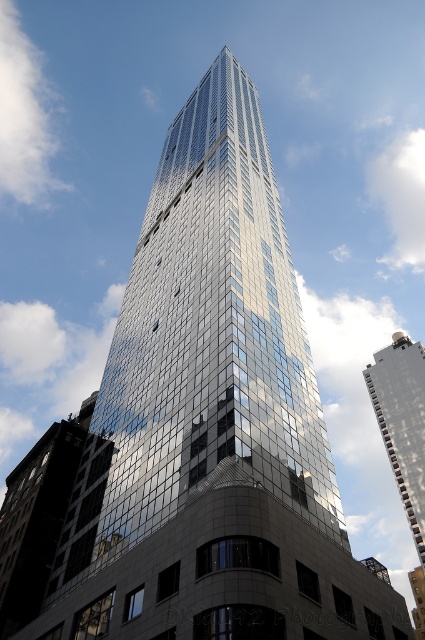
Is glossy glass building at center positioned before glossy glass building at upper center?

Yes, it is.

Is glossy glass building at center wider than glossy glass building at upper center?

Incorrect, glossy glass building at center's width does not surpass glossy glass building at upper center's.

Which is in front, point (42, 525) or point (413, 435)?

Point (42, 525)

The image size is (425, 640). I want to click on glossy glass building at center, so (37, 516).